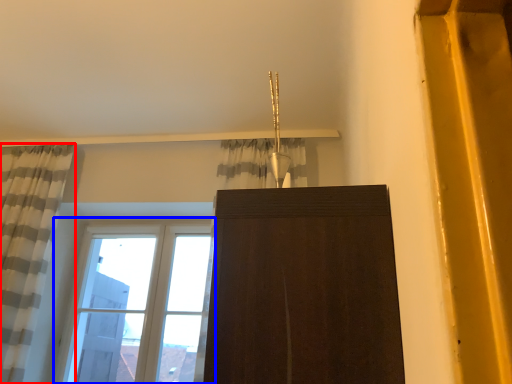
Question: Among these objects, which one is nearest to the camera, curtain (highlighted by a red box) or window (highlighted by a blue box)?

Choices:
 (A) curtain
 (B) window

Answer: (A)